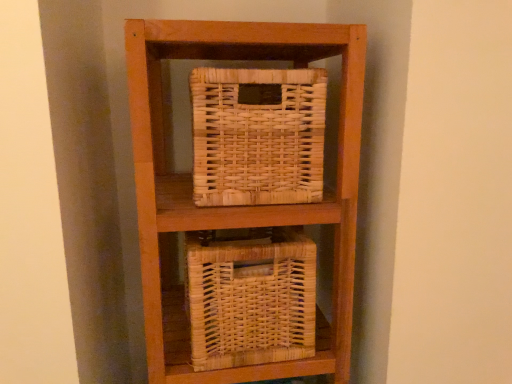
This screenshot has height=384, width=512. What do you see at coordinates (258, 136) in the screenshot?
I see `natural wicker basket at upper center, placed as the first basket when sorted from top to bottom` at bounding box center [258, 136].

The height and width of the screenshot is (384, 512). In order to click on natural wicker basket at upper center, the second basket from the bottom in this screenshot , I will do `click(258, 136)`.

Measure the distance between natural wicker basket at upper center, placed as the first basket when sorted from top to bottom, and camera.

natural wicker basket at upper center, placed as the first basket when sorted from top to bottom, is 27.20 inches from camera.

The image size is (512, 384). Describe the element at coordinates (250, 298) in the screenshot. I see `natural wicker basket at lower center, positioned as the first basket in bottom-to-top order` at that location.

You are a GUI agent. You are given a task and a screenshot of the screen. Output one action in this format:
    pyautogui.click(x=<x>, y=<y>)
    Task: Click on the natural wicker basket at lower center, positioned as the first basket in bottom-to-top order
    The width and height of the screenshot is (512, 384).
    Given the screenshot: What is the action you would take?
    tap(250, 298)

Where is `natural wicker basket at upper center, placed as the first basket when sorted from top to bottom`? The image size is (512, 384). natural wicker basket at upper center, placed as the first basket when sorted from top to bottom is located at coordinates (258, 136).

Which is more to the right, natural wicker basket at lower center, positioned as the 2th basket in top-to-bottom order, or natural wicker basket at upper center, placed as the first basket when sorted from top to bottom?

natural wicker basket at upper center, placed as the first basket when sorted from top to bottom, is more to the right.

Is natural wicker basket at lower center, positioned as the 2th basket in top-to-bottom order, further to camera compared to natural wicker basket at upper center, the second basket from the bottom?

Yes, natural wicker basket at lower center, positioned as the 2th basket in top-to-bottom order, is further from the camera.

Is point (202, 327) farther from viewer compared to point (305, 72)?

Yes, it is behind point (305, 72).

From the image's perspective, which one is positioned lower, natural wicker basket at lower center, positioned as the 2th basket in top-to-bottom order, or natural wicker basket at upper center, placed as the first basket when sorted from top to bottom?

natural wicker basket at lower center, positioned as the 2th basket in top-to-bottom order, appears lower in the image.

From a real-world perspective, is natural wicker basket at lower center, positioned as the 2th basket in top-to-bottom order, positioned over natural wicker basket at upper center, placed as the first basket when sorted from top to bottom, based on gravity?

Incorrect, from a real-world perspective, natural wicker basket at lower center, positioned as the 2th basket in top-to-bottom order, is lower than natural wicker basket at upper center, placed as the first basket when sorted from top to bottom.

Considering the relative sizes of natural wicker basket at lower center, positioned as the first basket in bottom-to-top order, and natural wicker basket at upper center, the second basket from the bottom, in the image provided, is natural wicker basket at lower center, positioned as the first basket in bottom-to-top order, thinner than natural wicker basket at upper center, the second basket from the bottom,?

In fact, natural wicker basket at lower center, positioned as the first basket in bottom-to-top order, might be wider than natural wicker basket at upper center, the second basket from the bottom.

Can you confirm if natural wicker basket at lower center, positioned as the 2th basket in top-to-bottom order, is taller than natural wicker basket at upper center, placed as the first basket when sorted from top to bottom?

Yes, natural wicker basket at lower center, positioned as the 2th basket in top-to-bottom order, is taller than natural wicker basket at upper center, placed as the first basket when sorted from top to bottom.

Between natural wicker basket at lower center, positioned as the 2th basket in top-to-bottom order, and natural wicker basket at upper center, the second basket from the bottom, which one has larger size?

Bigger between the two is natural wicker basket at lower center, positioned as the 2th basket in top-to-bottom order.

Choose the correct answer: Is natural wicker basket at lower center, positioned as the 2th basket in top-to-bottom order, inside natural wicker basket at upper center, placed as the first basket when sorted from top to bottom, or outside it?

natural wicker basket at lower center, positioned as the 2th basket in top-to-bottom order, is not enclosed by natural wicker basket at upper center, placed as the first basket when sorted from top to bottom.

Does natural wicker basket at lower center, positioned as the 2th basket in top-to-bottom order, touch natural wicker basket at upper center, the second basket from the bottom?

No.

Is natural wicker basket at lower center, positioned as the 2th basket in top-to-bottom order, oriented away from natural wicker basket at upper center, the second basket from the bottom?

natural wicker basket at lower center, positioned as the 2th basket in top-to-bottom order, is not turned away from natural wicker basket at upper center, the second basket from the bottom.

How much distance is there between natural wicker basket at lower center, positioned as the 2th basket in top-to-bottom order, and natural wicker basket at upper center, the second basket from the bottom?

18.98 centimeters.

This screenshot has height=384, width=512. In order to click on basket above the natural wicker basket at lower center, positioned as the first basket in bottom-to-top order (from the image's perspective) in this screenshot , I will do `click(258, 136)`.

Between natural wicker basket at upper center, placed as the first basket when sorted from top to bottom, and natural wicker basket at lower center, positioned as the 2th basket in top-to-bottom order, which one appears on the left side from the viewer's perspective?

natural wicker basket at lower center, positioned as the 2th basket in top-to-bottom order, is more to the left.

Which object is closer to the camera, natural wicker basket at upper center, placed as the first basket when sorted from top to bottom, or natural wicker basket at lower center, positioned as the 2th basket in top-to-bottom order?

Positioned in front is natural wicker basket at upper center, placed as the first basket when sorted from top to bottom.

Considering the points (219, 68) and (202, 308), which point is behind, point (219, 68) or point (202, 308)?

Point (202, 308)

From the image's perspective, is natural wicker basket at upper center, the second basket from the bottom, beneath natural wicker basket at lower center, positioned as the first basket in bottom-to-top order?

No.

From a real-world perspective, between natural wicker basket at upper center, the second basket from the bottom, and natural wicker basket at lower center, positioned as the first basket in bottom-to-top order, who is vertically higher?

natural wicker basket at upper center, the second basket from the bottom, from a real-world perspective.

Between natural wicker basket at upper center, the second basket from the bottom, and natural wicker basket at lower center, positioned as the 2th basket in top-to-bottom order, which one has smaller width?

Thinner between the two is natural wicker basket at upper center, the second basket from the bottom.

Considering the relative sizes of natural wicker basket at upper center, the second basket from the bottom, and natural wicker basket at lower center, positioned as the first basket in bottom-to-top order, in the image provided, is natural wicker basket at upper center, the second basket from the bottom, shorter than natural wicker basket at lower center, positioned as the first basket in bottom-to-top order,?

Correct, natural wicker basket at upper center, the second basket from the bottom, is not as tall as natural wicker basket at lower center, positioned as the first basket in bottom-to-top order.

Does natural wicker basket at upper center, placed as the first basket when sorted from top to bottom, have a smaller size compared to natural wicker basket at lower center, positioned as the 2th basket in top-to-bottom order?

Yes, natural wicker basket at upper center, placed as the first basket when sorted from top to bottom, is smaller than natural wicker basket at lower center, positioned as the 2th basket in top-to-bottom order.

Choose the correct answer: Is natural wicker basket at upper center, placed as the first basket when sorted from top to bottom, inside natural wicker basket at lower center, positioned as the first basket in bottom-to-top order, or outside it?

The correct answer is: outside.

Are natural wicker basket at upper center, the second basket from the bottom, and natural wicker basket at lower center, positioned as the first basket in bottom-to-top order, making contact?

No, natural wicker basket at upper center, the second basket from the bottom, is not beside natural wicker basket at lower center, positioned as the first basket in bottom-to-top order.

Is natural wicker basket at upper center, placed as the first basket when sorted from top to bottom, oriented towards natural wicker basket at lower center, positioned as the first basket in bottom-to-top order?

No, natural wicker basket at upper center, placed as the first basket when sorted from top to bottom, does not turn towards natural wicker basket at lower center, positioned as the first basket in bottom-to-top order.

Image resolution: width=512 pixels, height=384 pixels. In order to click on basket directly beneath the natural wicker basket at upper center, placed as the first basket when sorted from top to bottom (from a real-world perspective) in this screenshot , I will do `click(250, 298)`.

Locate an element on the screen. The height and width of the screenshot is (384, 512). basket that appears above the natural wicker basket at lower center, positioned as the 2th basket in top-to-bottom order (from the image's perspective) is located at coordinates (258, 136).

In the image, there is a natural wicker basket at upper center, the second basket from the bottom. Where is `basket below it (from the image's perspective)`? Image resolution: width=512 pixels, height=384 pixels. basket below it (from the image's perspective) is located at coordinates [x=250, y=298].